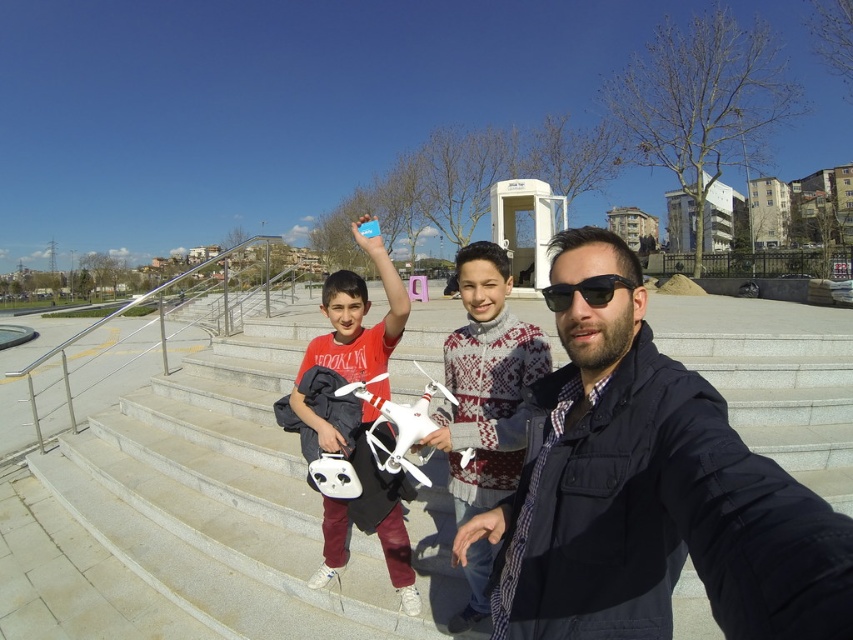
Can you confirm if white concrete stairs at center is wider than black plastic sunglasses at center?

Indeed, white concrete stairs at center has a greater width compared to black plastic sunglasses at center.

Who is taller, white concrete stairs at center or black plastic sunglasses at center?

With more height is white concrete stairs at center.

What are the coordinates of `white concrete stairs at center` in the screenshot? It's located at (241, 500).

Find the location of a particular element. This screenshot has width=853, height=640. dark blue jacket at center is located at coordinates (648, 493).

The height and width of the screenshot is (640, 853). What are the coordinates of `dark blue jacket at center` in the screenshot? It's located at (648, 493).

This screenshot has width=853, height=640. Find the location of `dark blue jacket at center`. dark blue jacket at center is located at coordinates (648, 493).

Who is positioned more to the right, white matte drone at center or black plastic sunglasses at center?

From the viewer's perspective, black plastic sunglasses at center appears more on the right side.

Is white matte drone at center to the left of black plastic sunglasses at center from the viewer's perspective?

Correct, you'll find white matte drone at center to the left of black plastic sunglasses at center.

Identify the location of white matte drone at center. This screenshot has width=853, height=640. (352, 332).